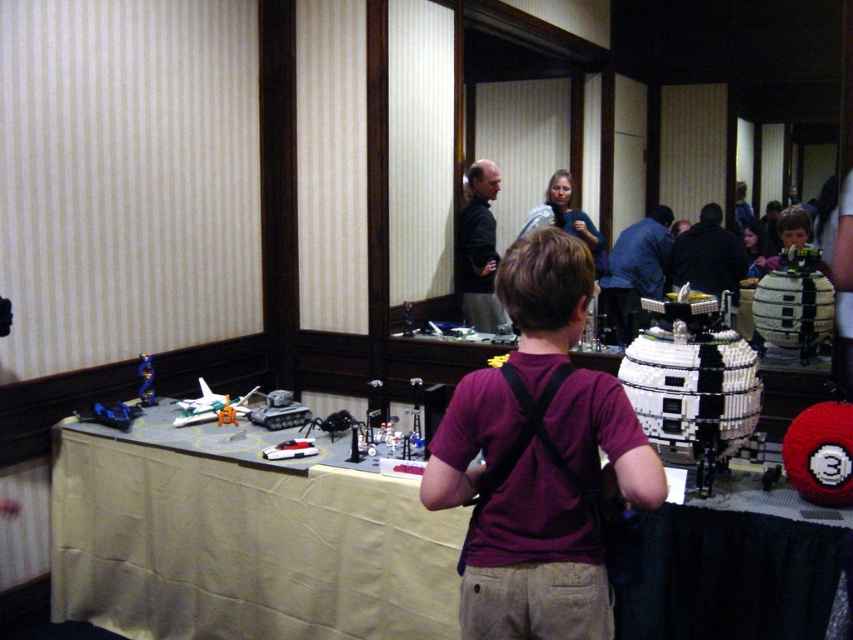
Question: Among these objects, which one is farthest from the camera?

Choices:
 (A) maroon t-shirt at center
 (B) dark blue shirt at center

Answer: (B)

Question: Considering the real-world distances, which object is closest to the maroon t-shirt at center?

Choices:
 (A) white fabric table at center
 (B) dark gray shirt at center

Answer: (A)

Question: Is white fabric table at center bigger than dark blue shirt at center?

Choices:
 (A) yes
 (B) no

Answer: (A)

Question: Which object is positioned closest to the dark gray shirt at center?

Choices:
 (A) white fabric table at center
 (B) dark blue shirt at center

Answer: (B)

Question: Can you confirm if dark gray shirt at center is wider than dark blue shirt at center?

Choices:
 (A) no
 (B) yes

Answer: (A)

Question: Can you confirm if white fabric table at center is wider than maroon t-shirt at center?

Choices:
 (A) no
 (B) yes

Answer: (B)